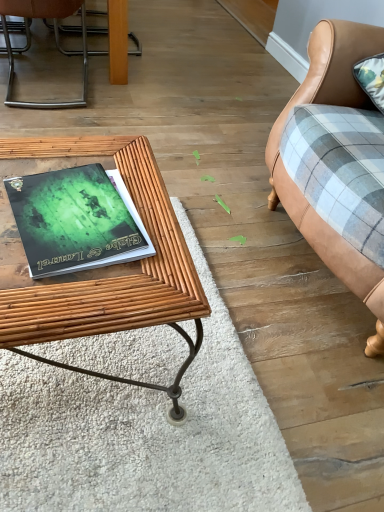
Question: From the image's perspective, does bambooobject at left appear lower than green matte book at center?

Choices:
 (A) yes
 (B) no

Answer: (B)

Question: Considering the relative sizes of bambooobject at left and green matte book at center in the image provided, is bambooobject at left taller than green matte book at center?

Choices:
 (A) yes
 (B) no

Answer: (A)

Question: Is bambooobject at left smaller than green matte book at center?

Choices:
 (A) yes
 (B) no

Answer: (B)

Question: Does bambooobject at left turn towards green matte book at center?

Choices:
 (A) yes
 (B) no

Answer: (B)

Question: Are bambooobject at left and green matte book at center located far from each other?

Choices:
 (A) no
 (B) yes

Answer: (A)

Question: In the image, is bambooobject at left positioned in front of or behind green matte book at center?

Choices:
 (A) front
 (B) behind

Answer: (A)

Question: Is bambooobject at left inside the boundaries of green matte book at center, or outside?

Choices:
 (A) outside
 (B) inside

Answer: (A)

Question: From a real-world perspective, relative to green matte book at center, is bambooobject at left vertically above or below?

Choices:
 (A) below
 (B) above

Answer: (A)

Question: In terms of height, does bambooobject at left look taller or shorter compared to green matte book at center?

Choices:
 (A) tall
 (B) short

Answer: (A)

Question: Considering the relative positions of metallic silver chair at upper left and green matte book at center in the image provided, is metallic silver chair at upper left to the left or to the right of green matte book at center?

Choices:
 (A) left
 (B) right

Answer: (A)

Question: From the image's perspective, is metallic silver chair at upper left positioned above or below green matte book at center?

Choices:
 (A) below
 (B) above

Answer: (B)

Question: In terms of size, does metallic silver chair at upper left appear bigger or smaller than green matte book at center?

Choices:
 (A) big
 (B) small

Answer: (A)

Question: From their relative heights in the image, would you say metallic silver chair at upper left is taller or shorter than green matte book at center?

Choices:
 (A) tall
 (B) short

Answer: (A)

Question: Based on their sizes in the image, would you say leather couch at right is bigger or smaller than bambooobject at left?

Choices:
 (A) big
 (B) small

Answer: (A)

Question: Considering their positions, is leather couch at right located in front of or behind bambooobject at left?

Choices:
 (A) behind
 (B) front

Answer: (B)